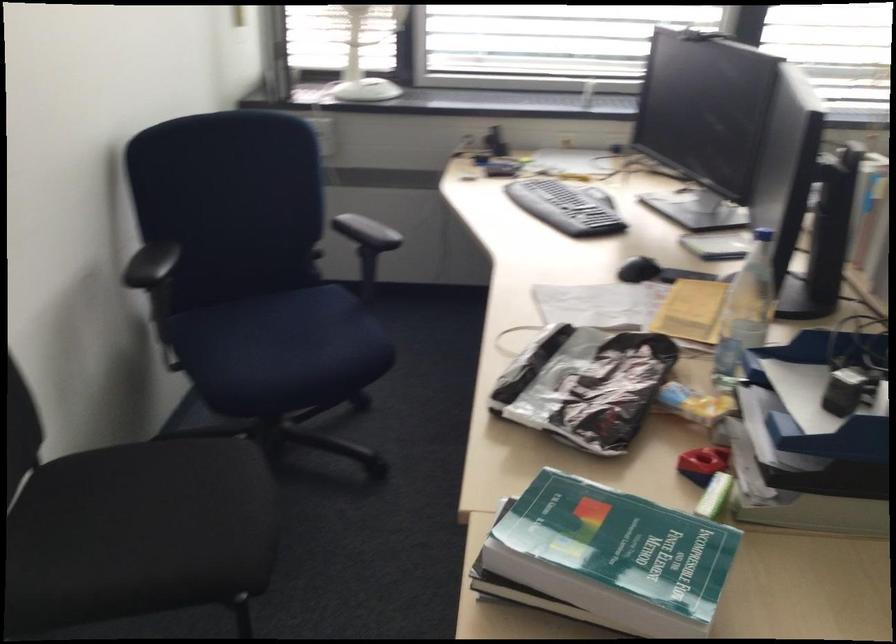
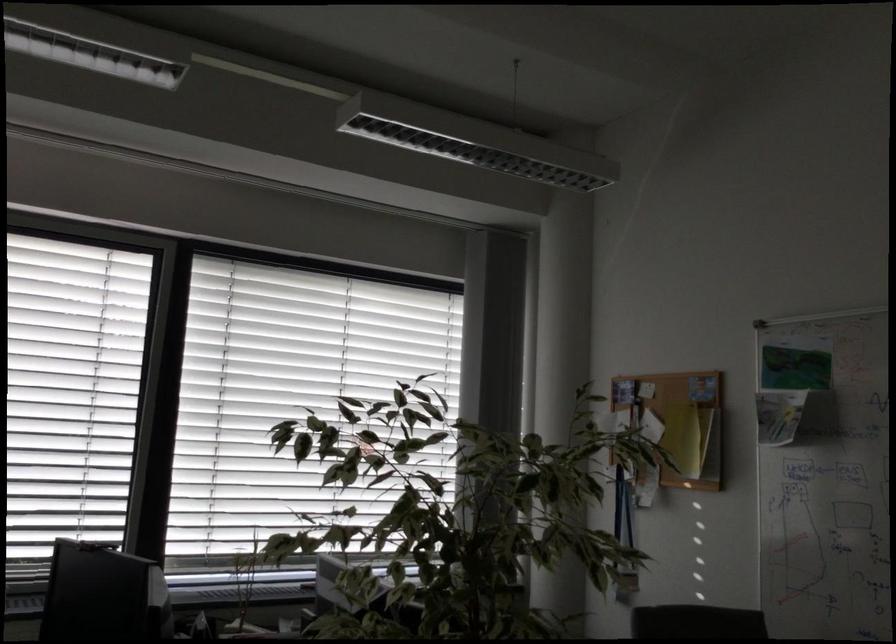
How did the camera likely rotate?

The camera's rotation is toward right-up.